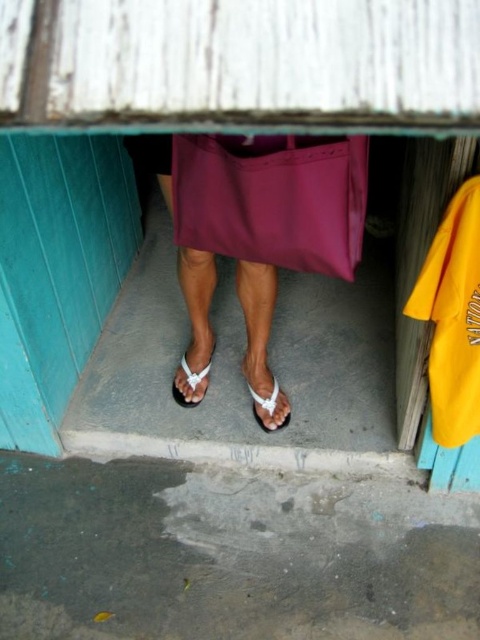
Question: Considering the real-world distances, which object is closest to the matte purple dress at center?

Choices:
 (A) white matte sandal at center
 (B) white fabric sandal at center
 (C) white plastic sandals at center

Answer: (C)

Question: Which point is farther to the camera?

Choices:
 (A) (204, 150)
 (B) (255, 413)
 (C) (268, 157)
 (D) (180, 394)

Answer: (D)

Question: Can you confirm if white plastic sandals at center is positioned to the right of white fabric sandal at center?

Choices:
 (A) yes
 (B) no

Answer: (B)

Question: Can you confirm if white plastic sandals at center is smaller than white matte sandal at center?

Choices:
 (A) no
 (B) yes

Answer: (A)

Question: Among these points, which one is nearest to the camera?

Choices:
 (A) (255, 401)
 (B) (264, 172)

Answer: (B)

Question: In this image, where is matte purple dress at center located relative to white fabric sandal at center?

Choices:
 (A) right
 (B) left

Answer: (B)